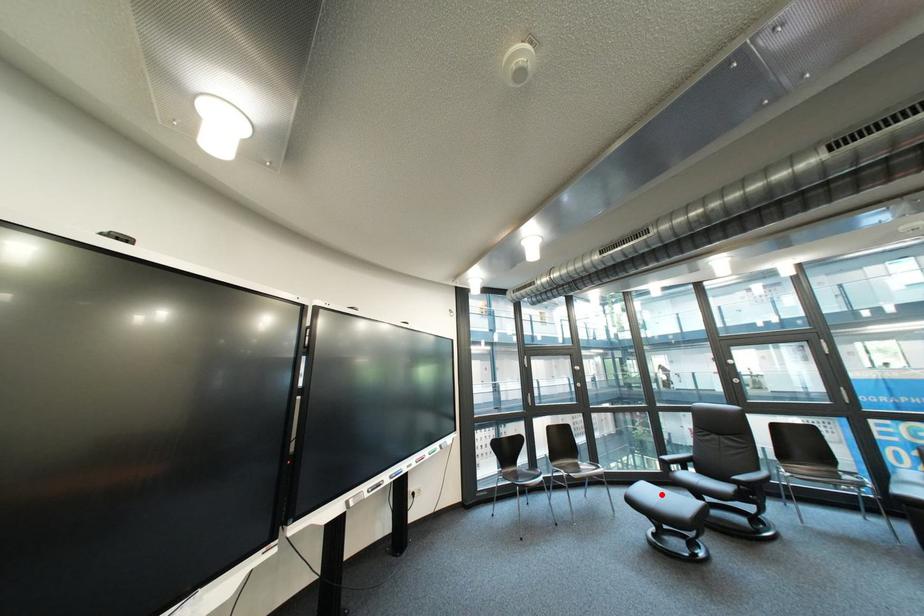
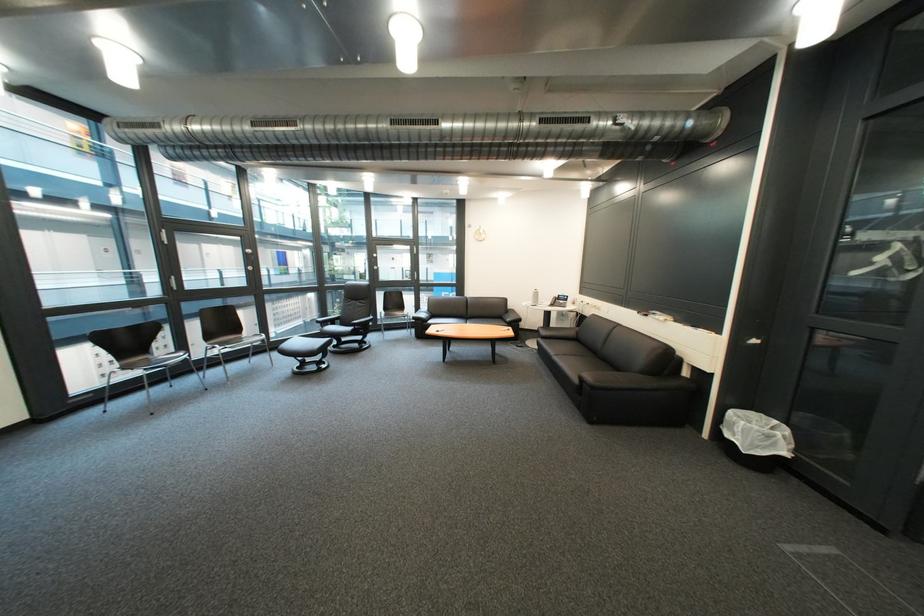
Question: I am providing you with two images of the same scene from different viewpoints. Given a red point in image1, look at the same physical point in image2. Is it:

Choices:
 (A) Closer to the viewpoint
 (B) Farther from the viewpoint

Answer: (A)